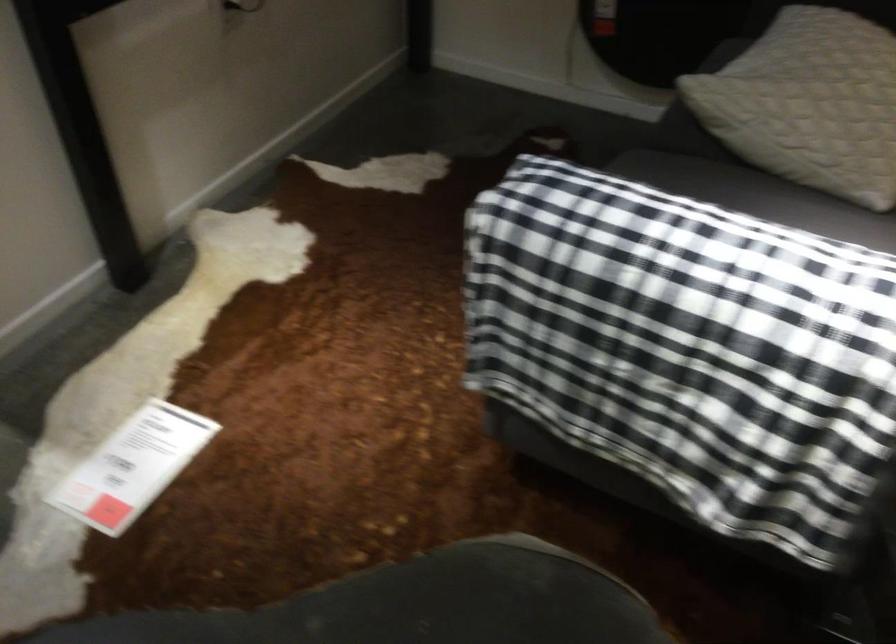
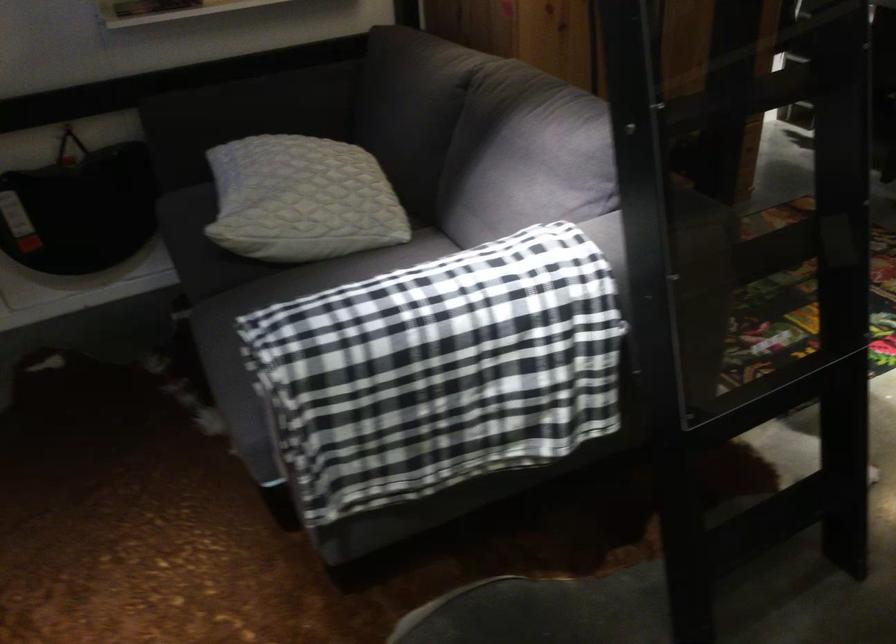
Question: The images are taken continuously from a first-person perspective. In which direction is your viewpoint rotating?

Choices:
 (A) Left
 (B) Right
 (C) Up
 (D) Down

Answer: (B)